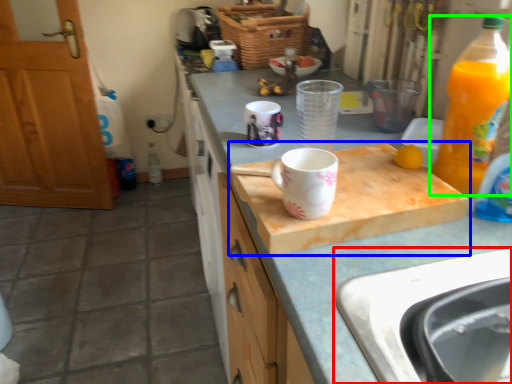
Question: Which object is the closest to the sink (highlighted by a red box)? Choose among these: cutting board (highlighted by a blue box) or bottle (highlighted by a green box).

Choices:
 (A) cutting board
 (B) bottle

Answer: (A)